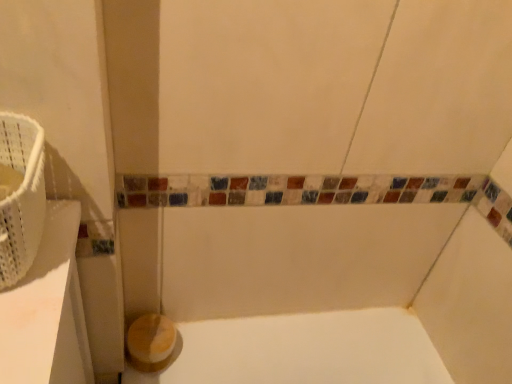
Question: Is wooden toilet paper at lower left at the right side of white woven basket at left?

Choices:
 (A) no
 (B) yes

Answer: (B)

Question: Can you confirm if wooden toilet paper at lower left is thinner than white woven basket at left?

Choices:
 (A) no
 (B) yes

Answer: (B)

Question: Can you confirm if wooden toilet paper at lower left is taller than white woven basket at left?

Choices:
 (A) no
 (B) yes

Answer: (A)

Question: Is wooden toilet paper at lower left facing away from white woven basket at left?

Choices:
 (A) no
 (B) yes

Answer: (A)

Question: Considering the relative sizes of wooden toilet paper at lower left and white woven basket at left in the image provided, is wooden toilet paper at lower left wider than white woven basket at left?

Choices:
 (A) yes
 (B) no

Answer: (B)

Question: From the image's perspective, does wooden toilet paper at lower left appear higher than white woven basket at left?

Choices:
 (A) yes
 (B) no

Answer: (B)

Question: Is white woven basket at left in front of wooden toilet paper at lower left?

Choices:
 (A) no
 (B) yes

Answer: (B)

Question: Is white woven basket at left oriented away from wooden toilet paper at lower left?

Choices:
 (A) no
 (B) yes

Answer: (A)

Question: Considering the relative positions of white woven basket at left and wooden toilet paper at lower left in the image provided, is white woven basket at left behind wooden toilet paper at lower left?

Choices:
 (A) yes
 (B) no

Answer: (B)

Question: Is white woven basket at left bigger than wooden toilet paper at lower left?

Choices:
 (A) no
 (B) yes

Answer: (B)

Question: Considering the relative sizes of white woven basket at left and wooden toilet paper at lower left in the image provided, is white woven basket at left smaller than wooden toilet paper at lower left?

Choices:
 (A) yes
 (B) no

Answer: (B)

Question: From a real-world perspective, is white woven basket at left positioned over wooden toilet paper at lower left based on gravity?

Choices:
 (A) no
 (B) yes

Answer: (B)

Question: From a real-world perspective, is wooden toilet paper at lower left physically located above or below white woven basket at left?

Choices:
 (A) above
 (B) below

Answer: (B)